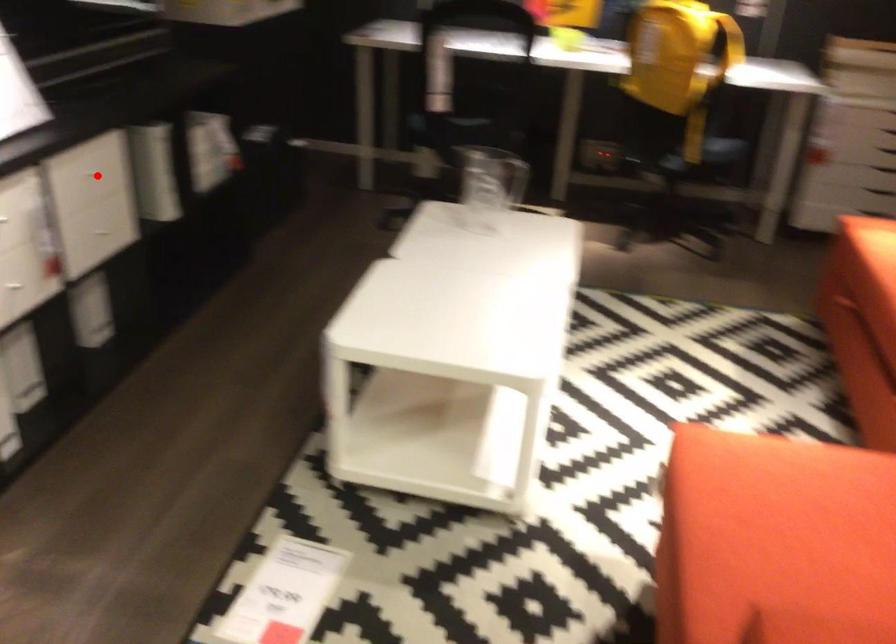
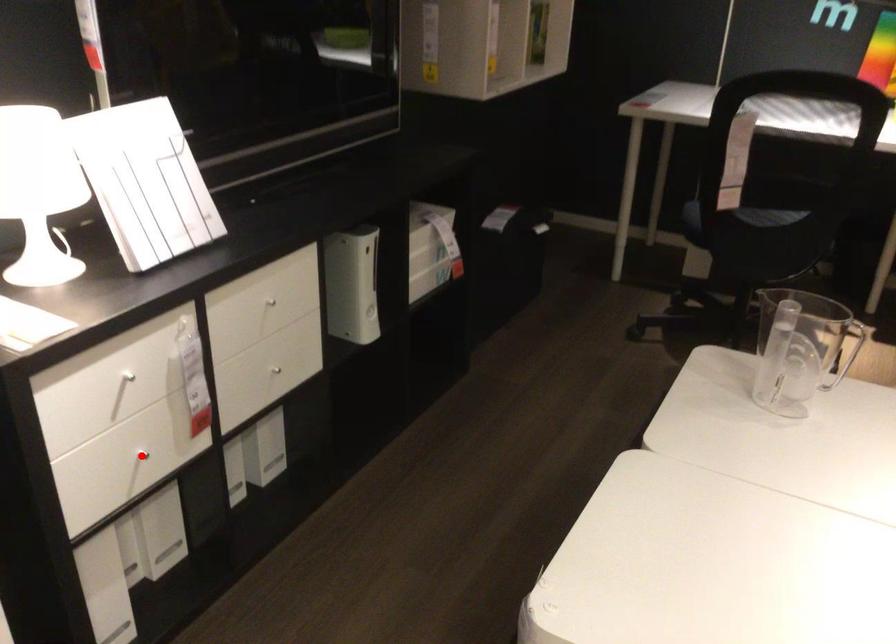
I am providing you with two images of the same scene from different viewpoints. A red point is marked on the first image and another point is marked on the second image. Does the point marked in image1 correspond to the same location as the one in image2?

No